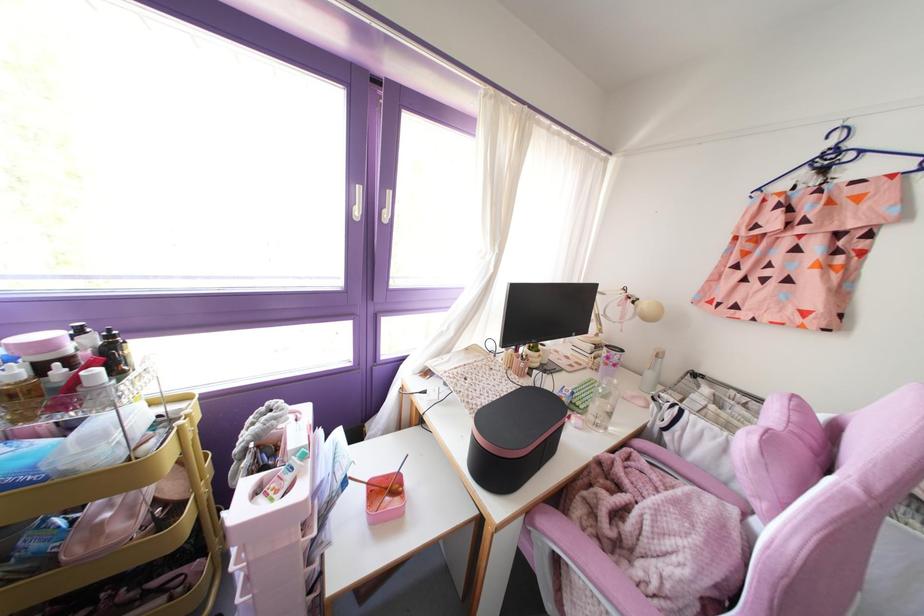
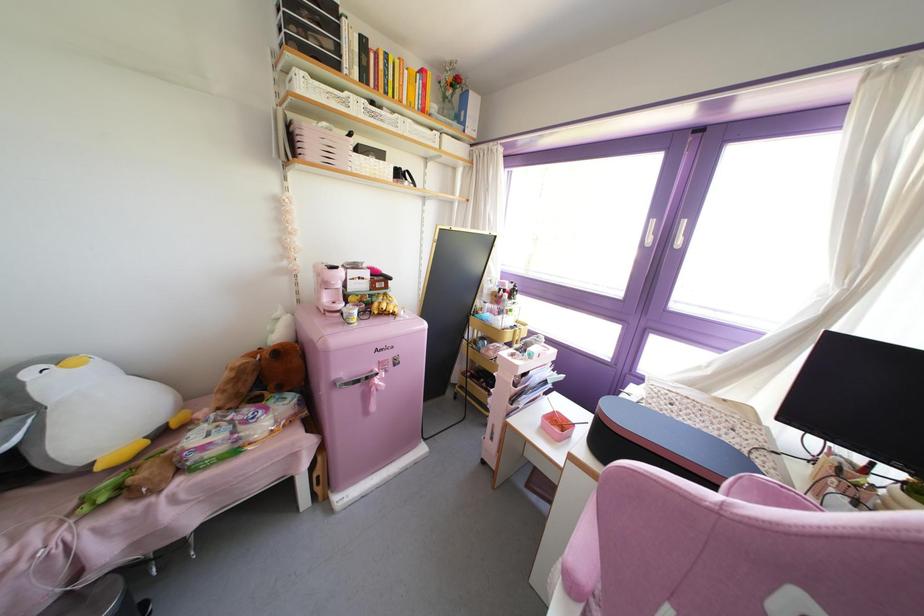
Where in the second image is the point corresponding to (245,462) from the first image?

(516, 345)